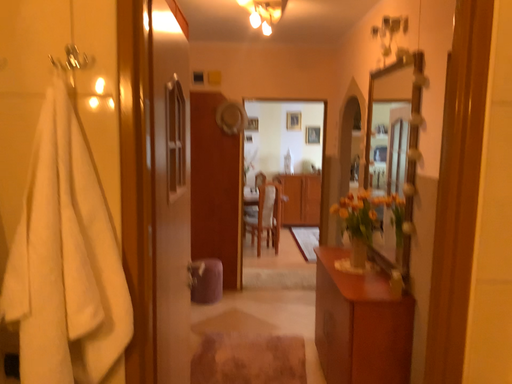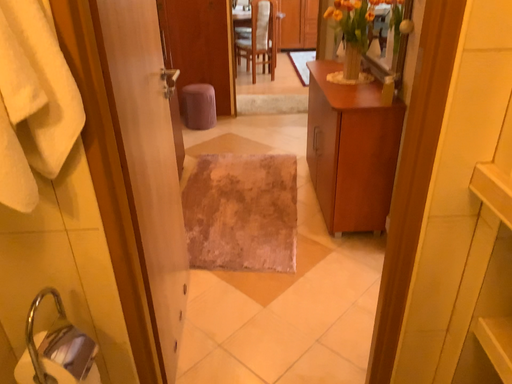
Question: How did the camera likely rotate when shooting the video?

Choices:
 (A) rotated downward
 (B) rotated upward

Answer: (A)